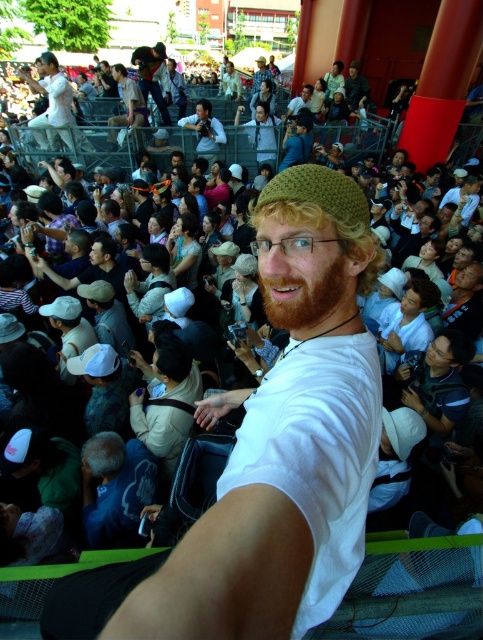
Is matte black camera at center positioned at the back of green knitted hat at center?

Yes, matte black camera at center is behind green knitted hat at center.

Which of these two, matte black camera at center or green knitted hat at center, stands taller?

matte black camera at center is taller.

This screenshot has width=483, height=640. Find the location of `matte black camera at center`. matte black camera at center is located at coordinates (204, 131).

Image resolution: width=483 pixels, height=640 pixels. I want to click on matte black camera at center, so click(x=204, y=131).

Between white cotton shirt at center and reddish-brown hair at center, which one appears on the right side from the viewer's perspective?

From the viewer's perspective, reddish-brown hair at center appears more on the right side.

Does white cotton shirt at center have a greater height compared to reddish-brown hair at center?

Correct, white cotton shirt at center is much taller as reddish-brown hair at center.

Who is more distant from viewer, (316, 461) or (285, 326)?

Point (285, 326)

This screenshot has height=640, width=483. Identify the location of white cotton shirt at center. (269, 460).

Can you confirm if reddish-brown hair at center is bigger than matte white shirt at upper left?

Actually, reddish-brown hair at center might be smaller than matte white shirt at upper left.

Who is positioned more to the right, reddish-brown hair at center or matte white shirt at upper left?

From the viewer's perspective, reddish-brown hair at center appears more on the right side.

Does point (331, 266) lie in front of point (61, 90)?

Yes, point (331, 266) is in front of point (61, 90).

At what (x,y) coordinates should I click in order to perform the action: click on reddish-brown hair at center. Please return your answer as a coordinate pair (x, y). This screenshot has width=483, height=640. Looking at the image, I should click on (303, 298).